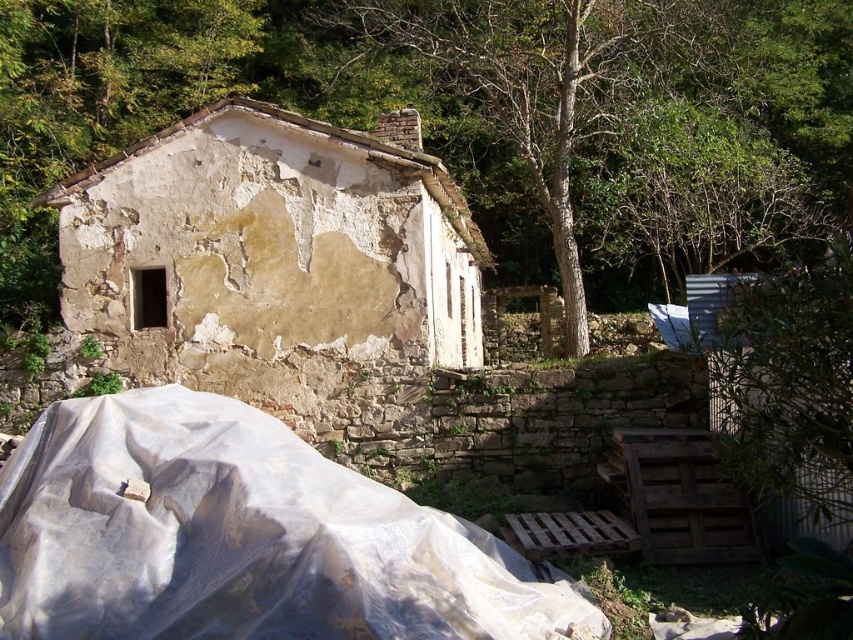
Question: Does transparent plastic at lower left have a lesser width compared to brown rough bark tree at upper center?

Choices:
 (A) yes
 (B) no

Answer: (A)

Question: Which point is closer to the camera taking this photo?

Choices:
 (A) (514, 60)
 (B) (77, 436)

Answer: (B)

Question: Which of the following is the closest to the observer?

Choices:
 (A) (515, 4)
 (B) (517, 589)

Answer: (B)

Question: Among these points, which one is nearest to the camera?

Choices:
 (A) (497, 115)
 (B) (36, 589)

Answer: (B)

Question: Is transparent plastic at lower left bigger than brown rough bark tree at upper center?

Choices:
 (A) yes
 (B) no

Answer: (B)

Question: Observing the image, what is the correct spatial positioning of transparent plastic at lower left in reference to brown rough bark tree at upper center?

Choices:
 (A) above
 (B) below

Answer: (B)